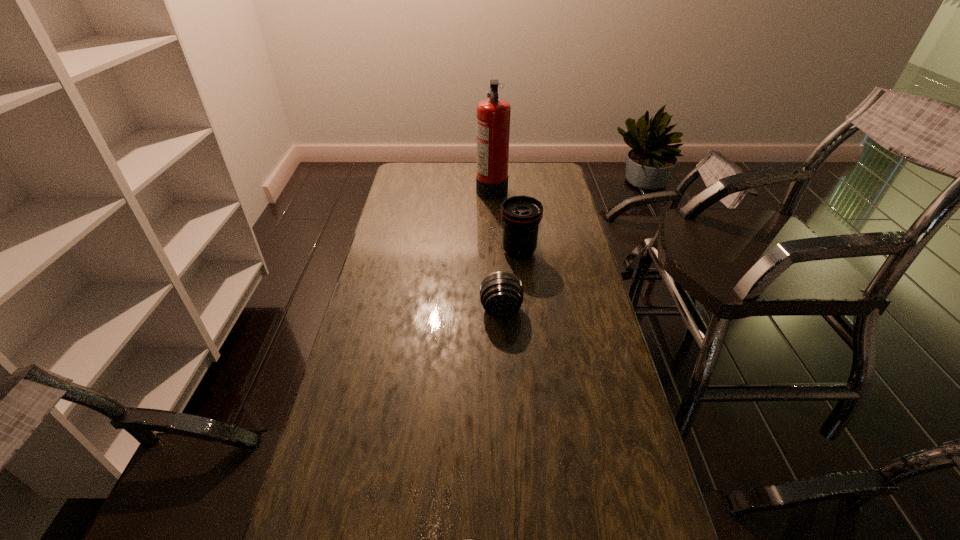
You are a GUI agent. You are given a task and a screenshot of the screen. Output one action in this format:
    pyautogui.click(x=<x>, y=<y>)
    Task: Click on the telephoto lens object that ranks as the third closest to the fire extinguisher
    Image resolution: width=960 pixels, height=540 pixels.
    Given the screenshot: What is the action you would take?
    pyautogui.click(x=471, y=539)

Identify the location of vacant space that satisfies the following two spatial constraints: 1. on the front-facing side of the tallest telephoto lens; 2. on the right side of the tallest object. (494, 252).

This screenshot has height=540, width=960. Identify the location of free location that satisfies the following two spatial constraints: 1. on the back side of the tallest telephoto lens; 2. on the front-facing side of the fire extinguisher. (512, 187).

Find the location of a particular element. Image resolution: width=960 pixels, height=540 pixels. blank area in the image that satisfies the following two spatial constraints: 1. on the front-facing side of the tallest object; 2. on the right side of the second tallest object is located at coordinates (494, 252).